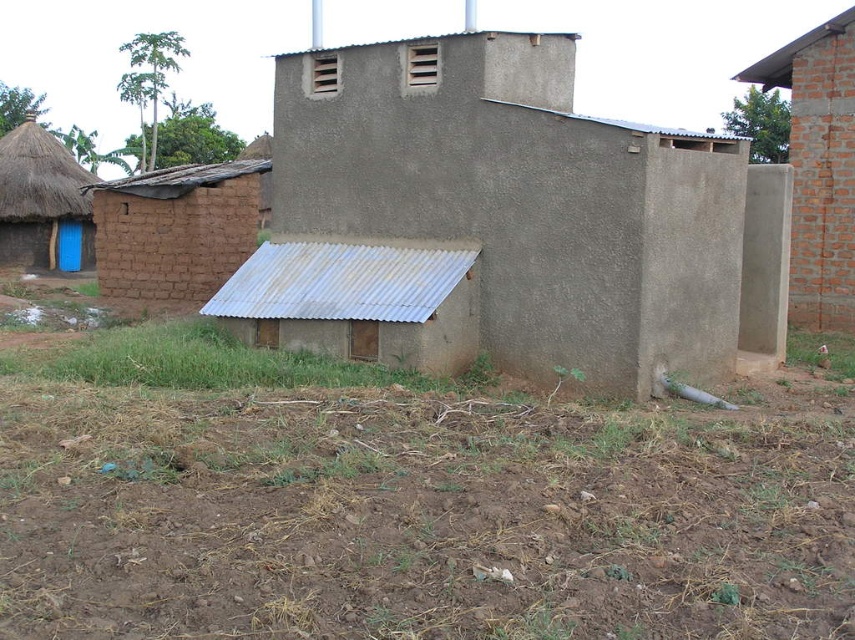
Can you confirm if rusty metal shed at lower center is positioned below brick wall at right?

Yes.

Between rusty metal shed at lower center and brick wall at right, which one appears on the left side from the viewer's perspective?

Positioned to the left is rusty metal shed at lower center.

Does point (352, 294) come in front of point (795, 93)?

Yes, point (352, 294) is in front of point (795, 93).

You are a GUI agent. You are given a task and a screenshot of the screen. Output one action in this format:
    pyautogui.click(x=<x>, y=<y>)
    Task: Click on the rusty metal shed at lower center
    The width and height of the screenshot is (855, 640).
    Given the screenshot: What is the action you would take?
    pyautogui.click(x=357, y=301)

Does brown soil at lower center have a greater height compared to blue wooden door at left?

Incorrect, brown soil at lower center's height is not larger of blue wooden door at left's.

The image size is (855, 640). What do you see at coordinates (423, 515) in the screenshot?
I see `brown soil at lower center` at bounding box center [423, 515].

The height and width of the screenshot is (640, 855). I want to click on brown soil at lower center, so click(x=423, y=515).

Does matte concrete hut at center have a greater width compared to rusty metal shed at lower center?

No, matte concrete hut at center is not wider than rusty metal shed at lower center.

Who is positioned more to the right, matte concrete hut at center or rusty metal shed at lower center?

Positioned to the right is matte concrete hut at center.

The height and width of the screenshot is (640, 855). What do you see at coordinates (496, 212) in the screenshot? I see `matte concrete hut at center` at bounding box center [496, 212].

Where is `matte concrete hut at center`? The width and height of the screenshot is (855, 640). matte concrete hut at center is located at coordinates (496, 212).